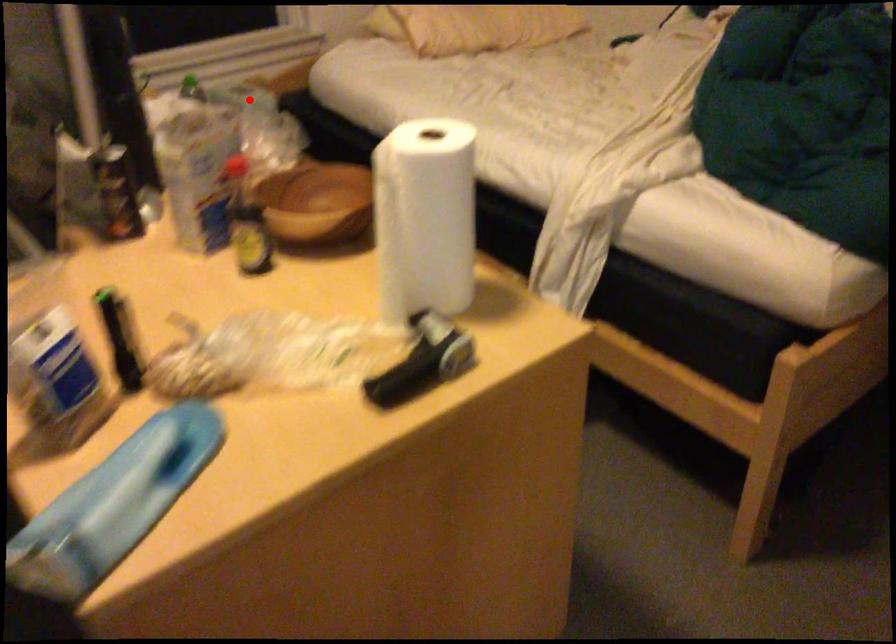
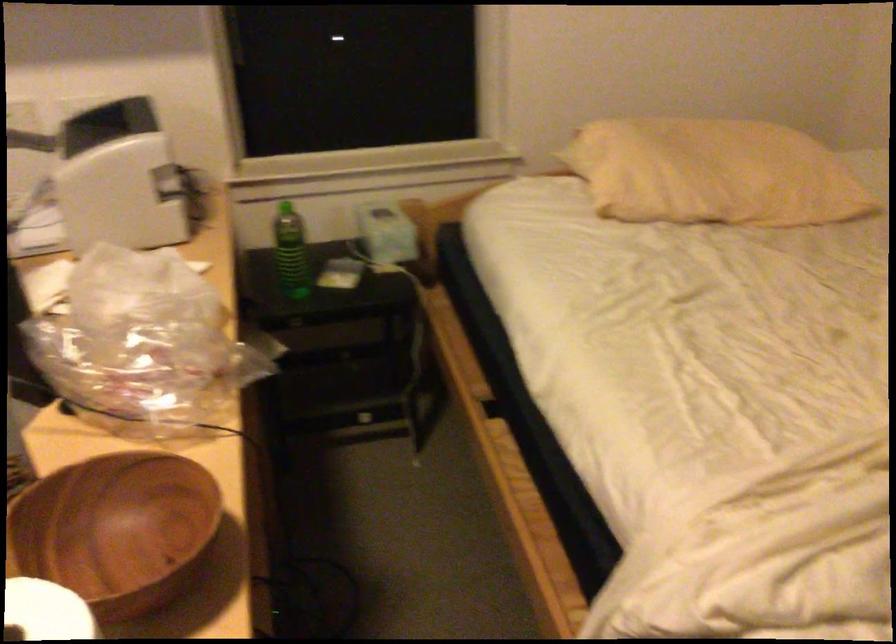
Question: I am providing you with two images of the same scene from different viewpoints. A red point is marked on the first image. Can you still see the location of the red point in image 2?

Choices:
 (A) Yes
 (B) No

Answer: (A)